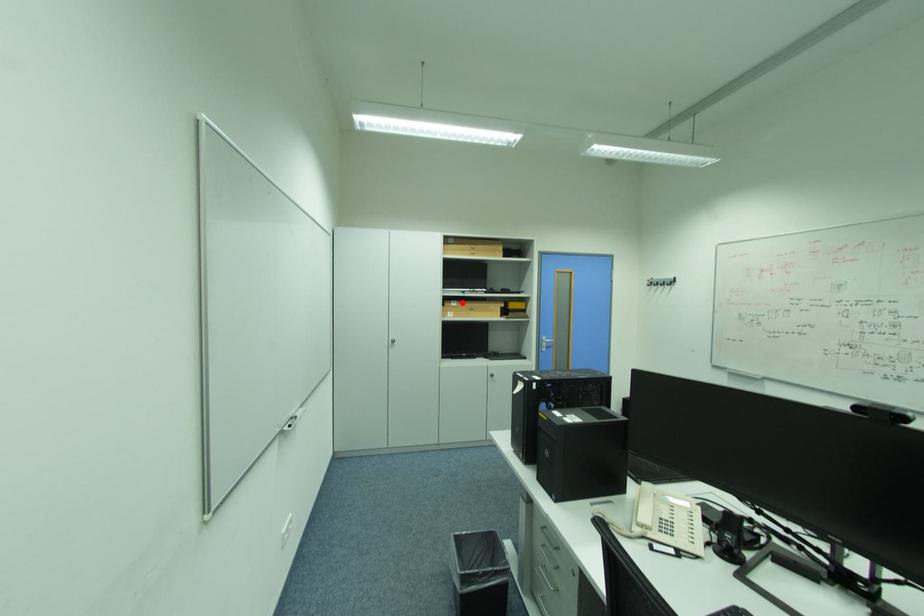
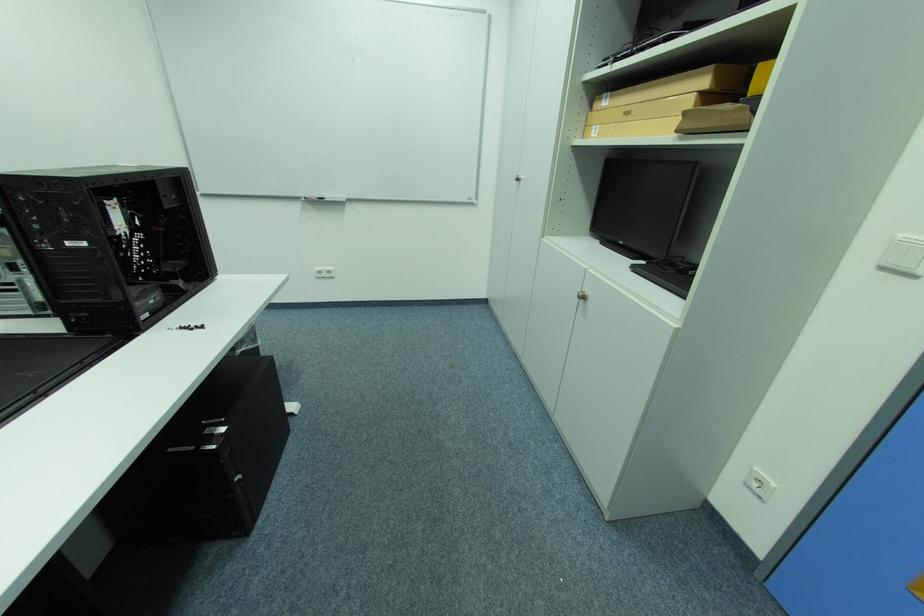
In the second image, find the point that corresponds to the highlighted location in the first image.

(614, 98)